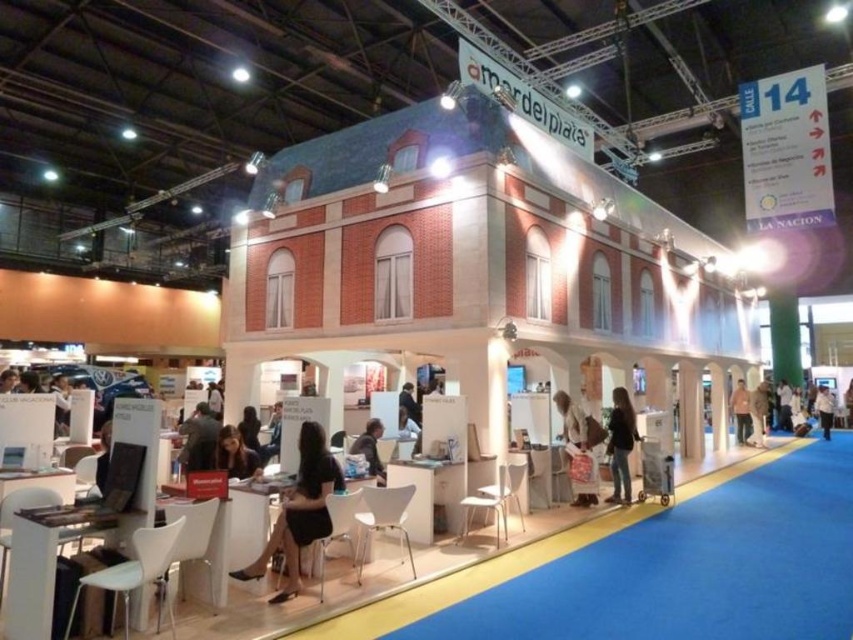
You are standing at the entrance of the booth and want to walk towards the point labeled point (622, 464). As you move forward, will you pass by the point labeled point (251, 440) first?

Since point (622, 464) is in front of point (251, 440), you will reach point (622, 464) before passing point (251, 440). Therefore, you will not pass by point (251, 440) first.

You are standing at the entrance of the booth and want to reach the point marked as point (757, 396). The booth has a light colored carpet inside and a blue carpet outside. Can you walk directly to this point from your current position without stepping on the blue carpet?

The distance between point (757, 396) and the viewer is 18.14 meters. Since the booth has a light colored carpet inside and blue outside, you need to ensure the path stays within the booth. However, without knowing the booth dimensions or the point location relative to booth boundaries, we can only confirm the distance, not the path feasibility. Please check the booth layout.